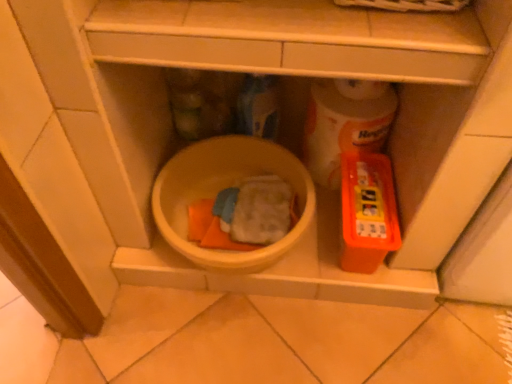
Question: In terms of width, does white glossy toilet paper at center right look wider or thinner when compared to orange plastic container at right?

Choices:
 (A) thin
 (B) wide

Answer: (A)

Question: From a real-world perspective, is white glossy toilet paper at center right positioned above or below orange plastic container at right?

Choices:
 (A) above
 (B) below

Answer: (A)

Question: Which of these objects is positioned farthest from the orange plastic container at right?

Choices:
 (A) yellow matte mixing bowl at center
 (B) white glossy toilet paper at center right

Answer: (A)

Question: Estimate the real-world distances between objects in this image. Which object is closer to the yellow matte mixing bowl at center?

Choices:
 (A) orange plastic container at right
 (B) white glossy toilet paper at center right

Answer: (B)